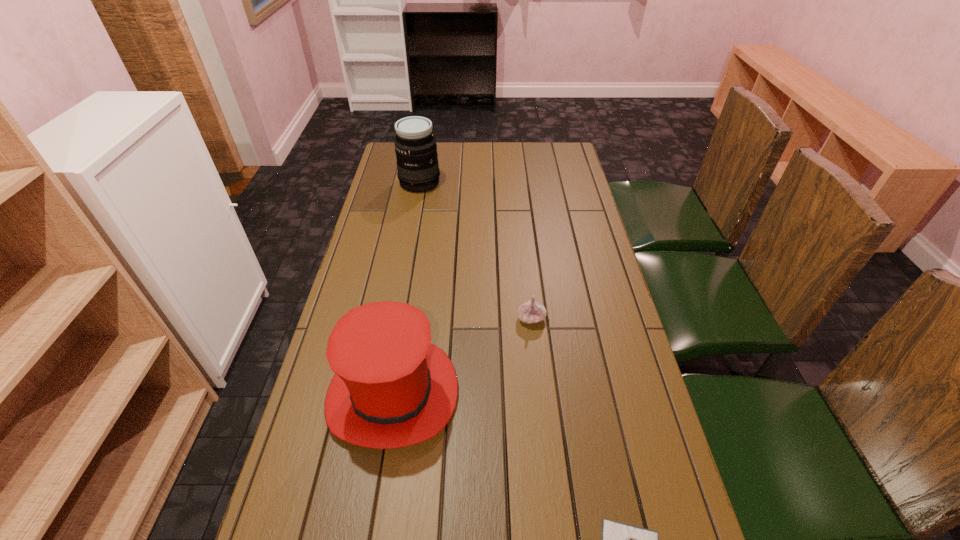
The width and height of the screenshot is (960, 540). Find the location of `the farthest object`. the farthest object is located at coordinates (415, 146).

This screenshot has height=540, width=960. Find the location of `the second nearest object`. the second nearest object is located at coordinates (392, 388).

Image resolution: width=960 pixels, height=540 pixels. I want to click on the left garlic, so (x=532, y=311).

Locate an element on the screen. the second shortest object is located at coordinates (532, 311).

Locate an element on the screen. vacant space located 0.140m on the right of the telephoto lens is located at coordinates (476, 183).

Image resolution: width=960 pixels, height=540 pixels. I want to click on blank space located on the back of the hat, so click(416, 255).

Locate an element on the screen. This screenshot has height=540, width=960. free location located 0.310m on the front of the second object from right to left is located at coordinates (545, 438).

Locate an element on the screen. The width and height of the screenshot is (960, 540). telephoto lens located in the left edge section of the desktop is located at coordinates (415, 146).

This screenshot has height=540, width=960. Identify the location of hat located in the left edge section of the desktop. (392, 388).

Where is `free space at the far edge of the desktop`? This screenshot has width=960, height=540. free space at the far edge of the desktop is located at coordinates (474, 146).